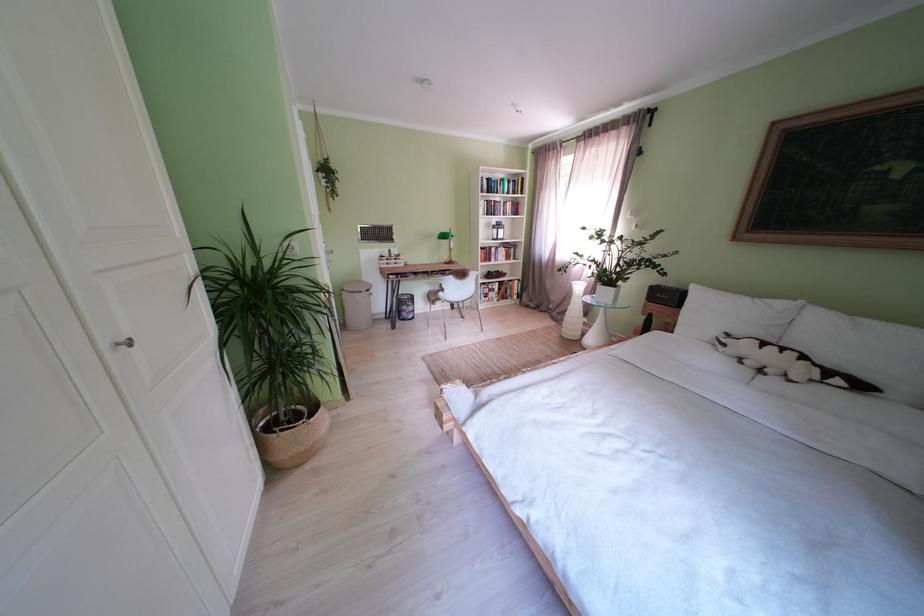
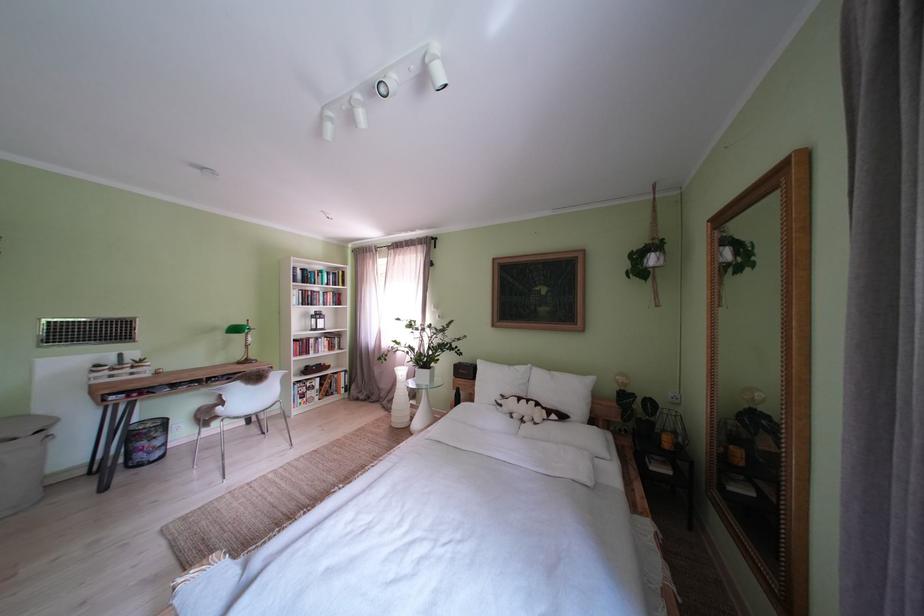
Where in the second image is the point corresponding to the point at 377,285 from the first image?

(52, 416)